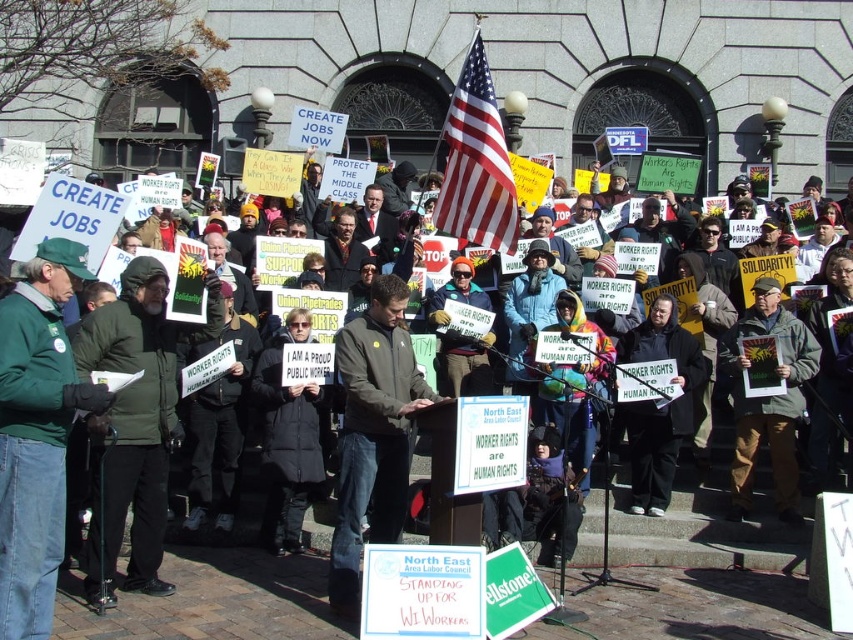
Question: Can you confirm if green fabric jacket at left is positioned to the right of black puffer jacket at center?

Choices:
 (A) no
 (B) yes

Answer: (A)

Question: Estimate the real-world distances between objects in this image. Which object is farther from the red/white striped fabric flag at center?

Choices:
 (A) green fabric jacket at center
 (B) dark gray jacket at center

Answer: (A)

Question: Is dark gray jacket at center to the right of green fabric jacket at center from the viewer's perspective?

Choices:
 (A) yes
 (B) no

Answer: (B)

Question: Does black puffer jacket at center come behind orange knit hat at center?

Choices:
 (A) yes
 (B) no

Answer: (B)

Question: Which object is closer to the camera taking this photo?

Choices:
 (A) black fabric coat at center
 (B) black puffer jacket at center
 (C) green fabric jacket at center
 (D) orange knit hat at center

Answer: (B)

Question: Which object is positioned farthest from the red/white striped fabric flag at center?

Choices:
 (A) black puffer jacket at center
 (B) orange knit hat at center
 (C) green fabric jacket at center

Answer: (C)